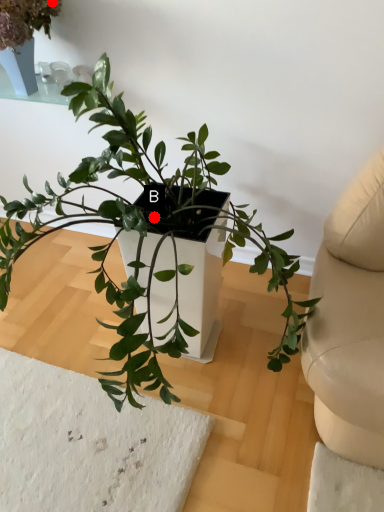
Question: Two points are circled on the image, labeled by A and B beside each circle. Which point is closer to the camera?

Choices:
 (A) A is closer
 (B) B is closer

Answer: (B)